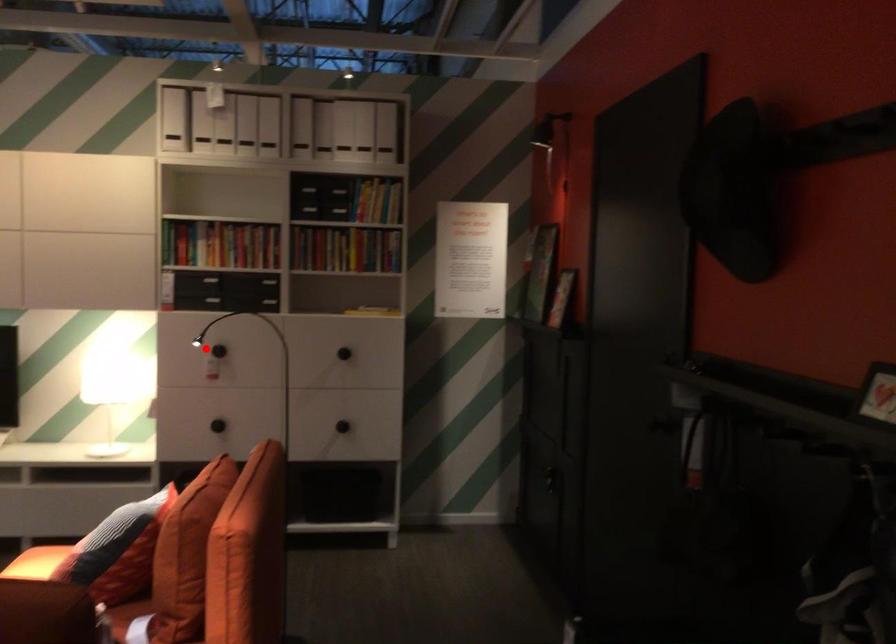
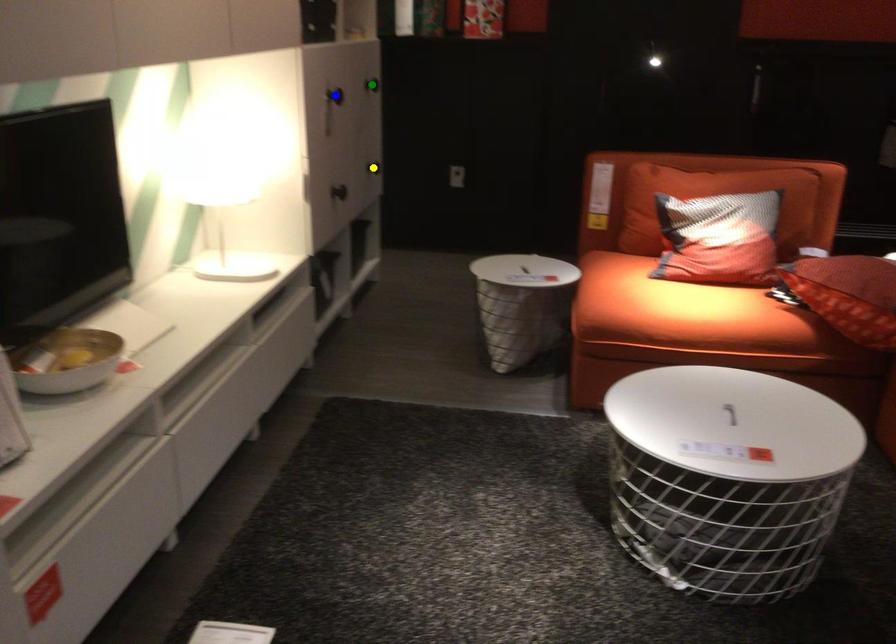
Question: I am providing you with two images of the same scene from different viewpoints. A red point is marked on the first image. You are given multiple points on the second image. Can you choose the point in image 2 that corresponds to the point in image 1?

Choices:
 (A) blue point
 (B) green point
 (C) yellow point

Answer: (A)